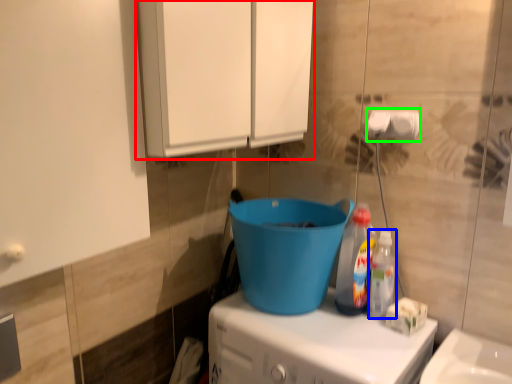
Question: Considering the real-world distances, which object is farthest from cabinetry (highlighted by a red box)? bottle (highlighted by a blue box) or toilet paper (highlighted by a green box)?

Choices:
 (A) bottle
 (B) toilet paper

Answer: (A)